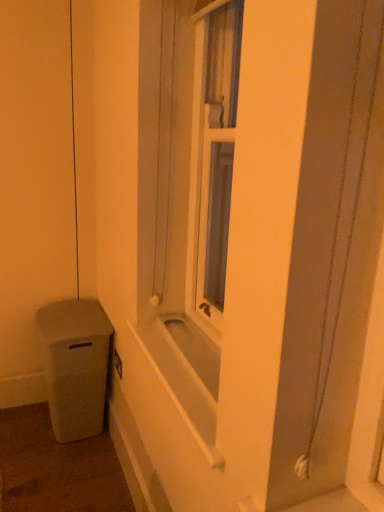
Image resolution: width=384 pixels, height=512 pixels. What are the coordinates of `free spot above matte gray trash can at lower left (from a real-world perspective)` in the screenshot? It's located at (60, 311).